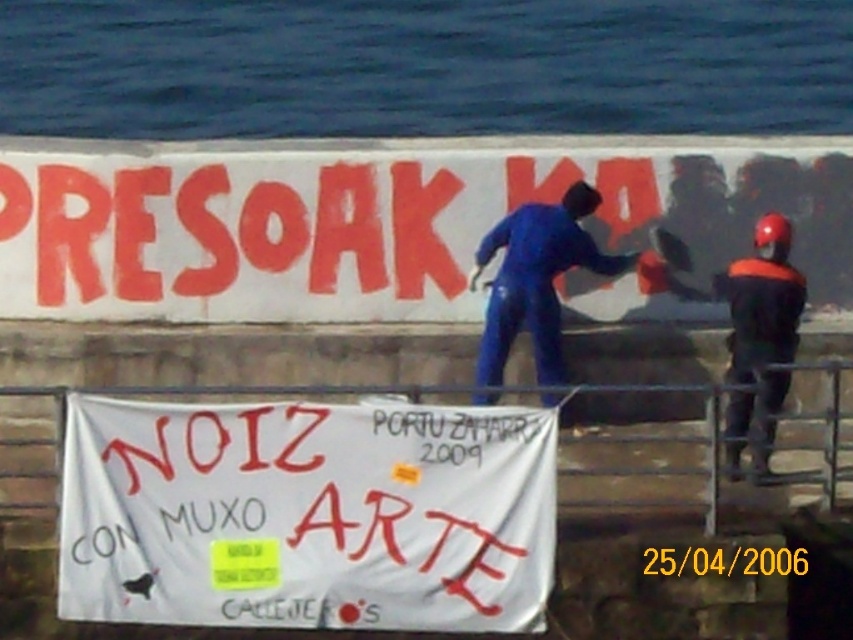
Image resolution: width=853 pixels, height=640 pixels. What do you see at coordinates (306, 515) in the screenshot?
I see `white paper banner at lower center` at bounding box center [306, 515].

You are a GUI agent. You are given a task and a screenshot of the screen. Output one action in this format:
    pyautogui.click(x=<x>, y=<y>)
    Task: Click on the white paper banner at lower center
    
    Given the screenshot: What is the action you would take?
    pyautogui.click(x=306, y=515)

Is point (91, 589) closer to viewer compared to point (502, 243)?

Yes.

Find the location of a particular element. The width and height of the screenshot is (853, 640). white paper banner at lower center is located at coordinates (306, 515).

Is blue water at upper center shorter than blue rubber suit at center?

No.

Is point (479, 116) closer to viewer compared to point (575, 253)?

No, (479, 116) is behind (575, 253).

At what (x,y) coordinates should I click in order to perform the action: click on blue water at upper center. Please return your answer as a coordinate pair (x, y). Looking at the image, I should click on (422, 67).

I want to click on blue water at upper center, so click(422, 67).

Can you confirm if blue water at upper center is shorter than yellow paper sticker at lower center?

Incorrect, blue water at upper center's height does not fall short of yellow paper sticker at lower center's.

Where is `blue water at upper center`? This screenshot has height=640, width=853. blue water at upper center is located at coordinates (422, 67).

In order to click on blue water at upper center in this screenshot , I will do `click(422, 67)`.